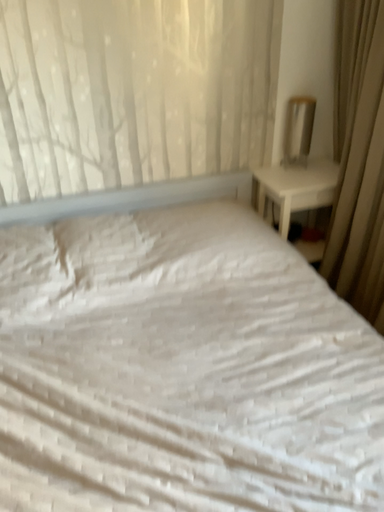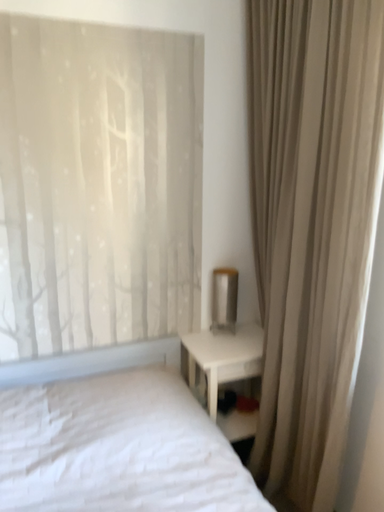
Question: How did the camera likely rotate when shooting the video?

Choices:
 (A) rotated downward
 (B) rotated upward

Answer: (B)